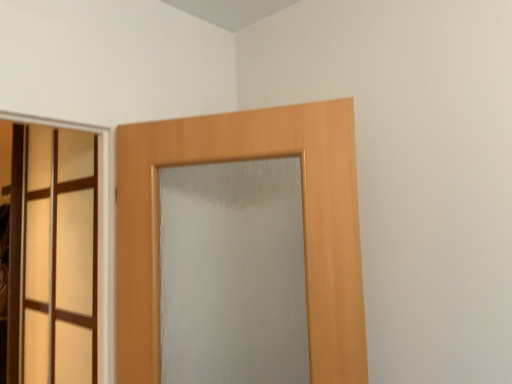
Question: Is translucent glass door at left, acting as the second door starting from the right, turned away from wooden door at center, arranged as the first door when viewed from the front?

Choices:
 (A) no
 (B) yes

Answer: (A)

Question: From a real-world perspective, is translucent glass door at left, the first door positioned from the left, positioned over wooden door at center, arranged as the first door when viewed from the front, based on gravity?

Choices:
 (A) yes
 (B) no

Answer: (B)

Question: Can you see translucent glass door at left, acting as the second door starting from the right, touching wooden door at center, which appears as the 1th door when viewed from the right?

Choices:
 (A) no
 (B) yes

Answer: (A)

Question: From the image's perspective, would you say translucent glass door at left, marked as the 1th door in a back-to-front arrangement, is shown under wooden door at center, arranged as the first door when viewed from the front?

Choices:
 (A) no
 (B) yes

Answer: (B)

Question: Can you confirm if translucent glass door at left, acting as the second door starting from the right, is thinner than wooden door at center, marked as the 2th door in a back-to-front arrangement?

Choices:
 (A) no
 (B) yes

Answer: (B)

Question: From the image's perspective, would you say translucent glass door at left, marked as the second door in a front-to-back arrangement, is positioned over wooden door at center, the second door from the left?

Choices:
 (A) yes
 (B) no

Answer: (B)

Question: Are wooden door at center, marked as the 2th door in a back-to-front arrangement, and translucent glass door at left, marked as the 1th door in a back-to-front arrangement, located far from each other?

Choices:
 (A) yes
 (B) no

Answer: (B)

Question: Considering the relative positions of wooden door at center, marked as the 2th door in a back-to-front arrangement, and translucent glass door at left, acting as the second door starting from the right, in the image provided, is wooden door at center, marked as the 2th door in a back-to-front arrangement, to the left of translucent glass door at left, acting as the second door starting from the right, from the viewer's perspective?

Choices:
 (A) no
 (B) yes

Answer: (A)

Question: From a real-world perspective, is wooden door at center, arranged as the first door when viewed from the front, located beneath translucent glass door at left, acting as the second door starting from the right?

Choices:
 (A) no
 (B) yes

Answer: (A)

Question: Is wooden door at center, the second door from the left, facing towards translucent glass door at left, marked as the 1th door in a back-to-front arrangement?

Choices:
 (A) no
 (B) yes

Answer: (A)

Question: Is wooden door at center, which appears as the 1th door when viewed from the right, shorter than translucent glass door at left, the first door positioned from the left?

Choices:
 (A) no
 (B) yes

Answer: (B)

Question: Is translucent glass door at left, the first door positioned from the left, located within wooden door at center, the second door from the left?

Choices:
 (A) no
 (B) yes

Answer: (A)

Question: From the image's perspective, is wooden door at center, marked as the 2th door in a back-to-front arrangement, located above or below translucent glass door at left, marked as the 1th door in a back-to-front arrangement?

Choices:
 (A) above
 (B) below

Answer: (A)